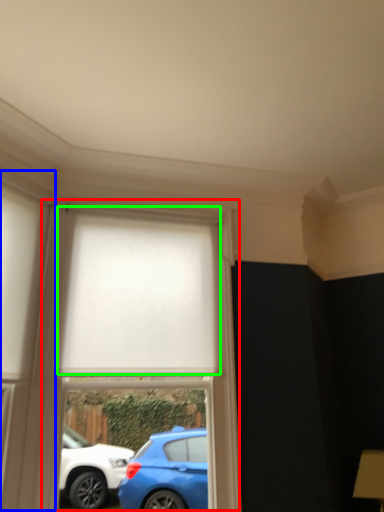
Question: Which object is positioned closest to bay window (highlighted by a red box)? Select from glass door (highlighted by a blue box) and curtain (highlighted by a green box).

Choices:
 (A) glass door
 (B) curtain

Answer: (B)